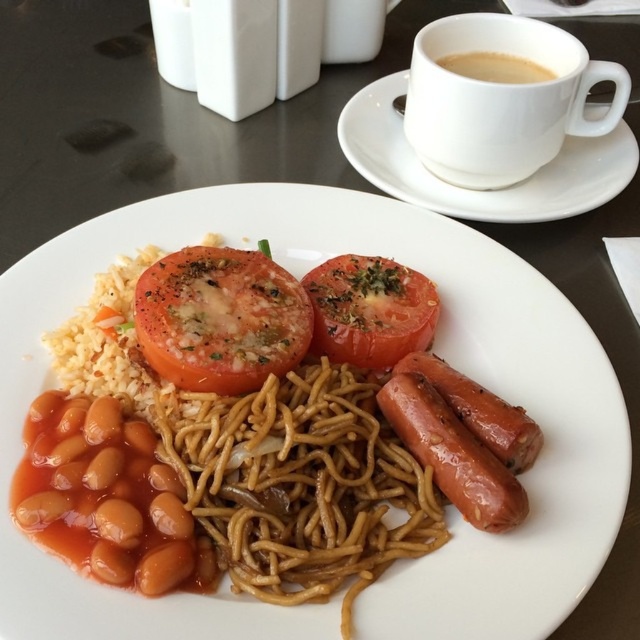
Is the position of brown matte noodles at center less distant than that of slightly charred tomato at center?

That is True.

Which is in front, point (516, 259) or point (412, 333)?

Positioned in front is point (412, 333).

Identify the location of brown matte noodles at center. (435, 349).

Does brown matte noodles at center appear on the left side of white ceramic cup at upper center?

Indeed, brown matte noodles at center is positioned on the left side of white ceramic cup at upper center.

Is brown matte noodles at center to the right of white ceramic cup at upper center from the viewer's perspective?

Incorrect, brown matte noodles at center is not on the right side of white ceramic cup at upper center.

Locate an element on the screen. This screenshot has height=640, width=640. brown matte noodles at center is located at coordinates (435, 349).

Can you confirm if slightly charred tomato at center is bigger than brown glazed sausage at lower right?

No.

Does slightly charred tomato at center appear under brown glazed sausage at lower right?

No, slightly charred tomato at center is not below brown glazed sausage at lower right.

Is point (317, 285) positioned behind point (445, 448)?

Yes, point (317, 285) is farther from viewer.

Identify the location of slightly charred tomato at center. The width and height of the screenshot is (640, 640). (369, 310).